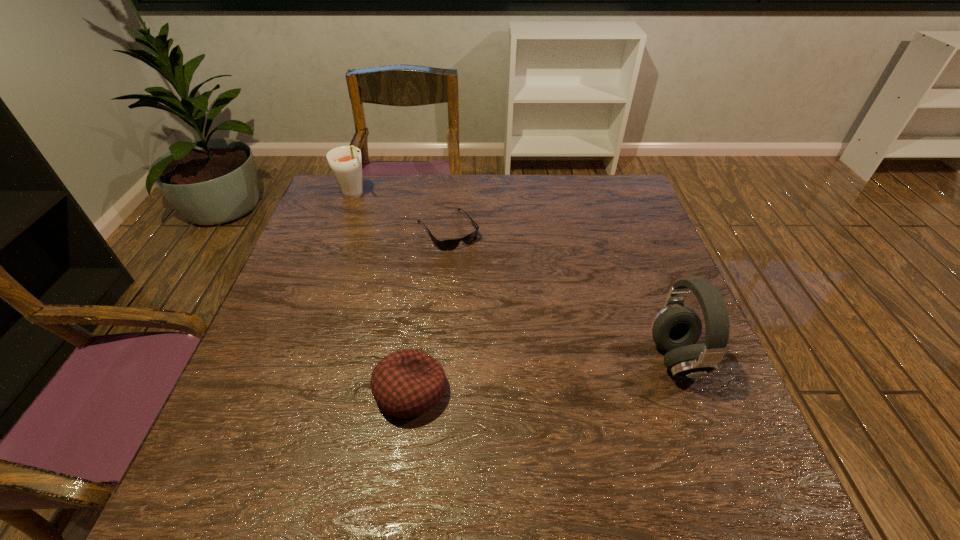
What are the coordinates of `free location at the near edge of the desktop` in the screenshot? It's located at (390, 426).

Where is `vacant region at the left edge of the desktop`? The width and height of the screenshot is (960, 540). vacant region at the left edge of the desktop is located at coordinates (259, 376).

Locate an element on the screen. vacant space at the right edge of the desktop is located at coordinates (660, 290).

Identify the location of vacant space at the far right corner of the desktop. The width and height of the screenshot is (960, 540). (585, 183).

I want to click on vacant region at the near right corner, so click(662, 437).

This screenshot has width=960, height=540. In order to click on vacant area that lies between the farthest object and the headset in this screenshot , I will do `click(516, 277)`.

This screenshot has width=960, height=540. Find the location of `free space that is in between the second shortest object and the sunglasses`. free space that is in between the second shortest object and the sunglasses is located at coordinates (429, 310).

This screenshot has width=960, height=540. What are the coordinates of `vacant space that's between the sunglasses and the headset` in the screenshot? It's located at (562, 294).

Where is `vacant region between the leftmost object and the headset`? vacant region between the leftmost object and the headset is located at coordinates (516, 277).

Where is `free space between the rightmost object and the second farthest object`? Image resolution: width=960 pixels, height=540 pixels. free space between the rightmost object and the second farthest object is located at coordinates (562, 294).